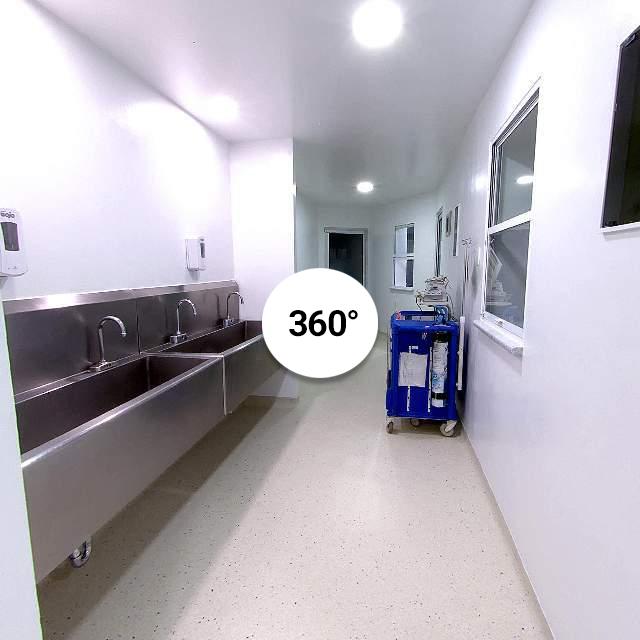
The height and width of the screenshot is (640, 640). I want to click on door, so click(x=339, y=246).